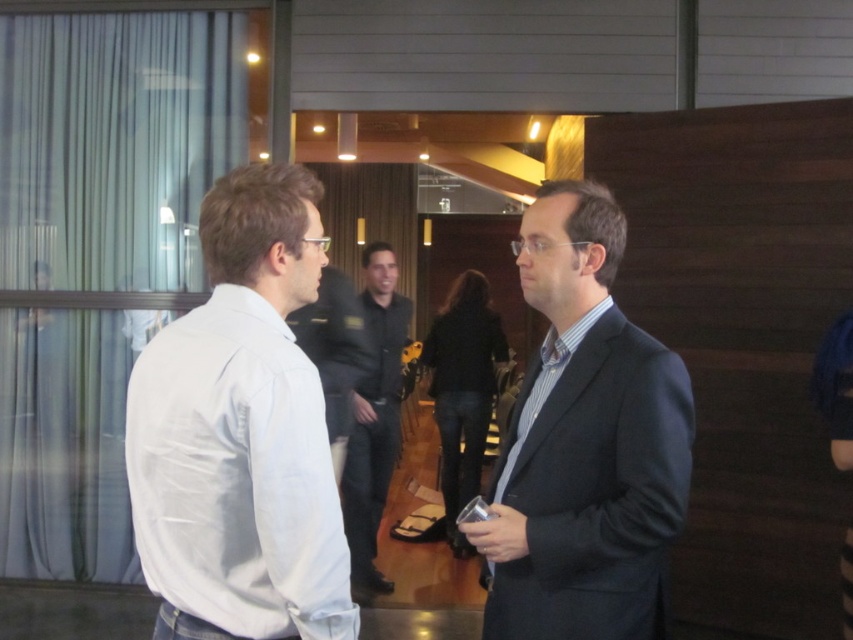
Question: Which of these objects is positioned farthest from the dark blue suit at center?

Choices:
 (A) dark gray shirt at center
 (B) white cotton shirt at left

Answer: (A)

Question: Which of the following is the closest to the observer?

Choices:
 (A) white cotton shirt at left
 (B) dark gray shirt at center

Answer: (A)

Question: Does white cotton shirt at left appear over dark gray shirt at center?

Choices:
 (A) no
 (B) yes

Answer: (B)

Question: Which object is closer to the camera taking this photo?

Choices:
 (A) dark gray shirt at center
 (B) dark blue suit at center
 (C) white cotton shirt at left

Answer: (C)

Question: Is dark blue suit at center positioned at the back of dark gray shirt at center?

Choices:
 (A) yes
 (B) no

Answer: (B)

Question: Does dark blue suit at center appear on the left side of dark gray shirt at center?

Choices:
 (A) no
 (B) yes

Answer: (A)